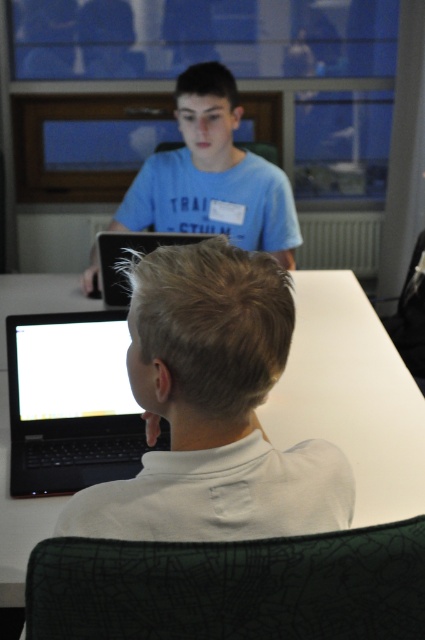
Question: Can you confirm if black glossy laptop at lower left is bigger than black matte laptop at center?

Choices:
 (A) yes
 (B) no

Answer: (B)

Question: Which point appears farthest from the camera in this image?

Choices:
 (A) (113, 301)
 (B) (64, 291)

Answer: (B)

Question: Does white glossy table at center appear over black matte laptop at center?

Choices:
 (A) no
 (B) yes

Answer: (A)

Question: Based on their relative distances, which object is nearer to the white glossy table at center?

Choices:
 (A) blue cotton shirt at upper center
 (B) white glossy laptop at lower left
 (C) black glossy laptop at lower left

Answer: (C)

Question: Which object is the farthest from the white glossy table at center?

Choices:
 (A) white glossy laptop at lower left
 (B) black glossy laptop at lower left

Answer: (A)

Question: Is white glossy table at center thinner than black glossy laptop at lower left?

Choices:
 (A) yes
 (B) no

Answer: (B)